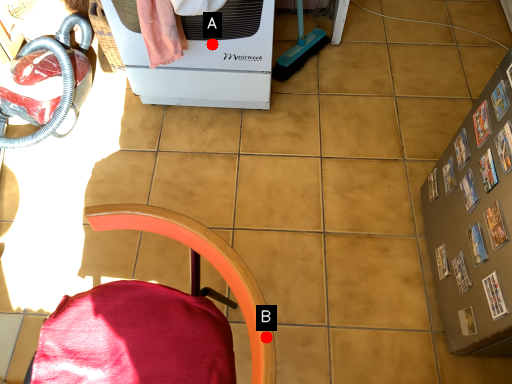
Question: Two points are circled on the image, labeled by A and B beside each circle. Among these points, which one is farthest from the camera?

Choices:
 (A) A is further
 (B) B is further

Answer: (A)